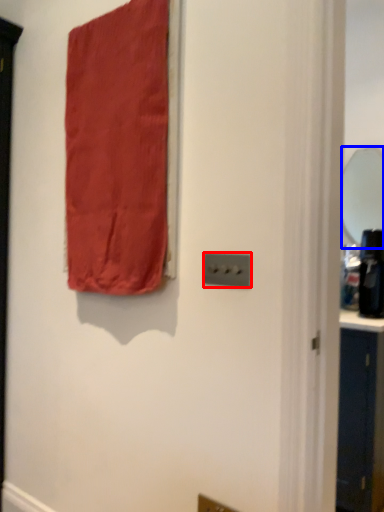
Question: Which of the following is the farthest to the observer, light switch (highlighted by a red box) or mirror (highlighted by a blue box)?

Choices:
 (A) light switch
 (B) mirror

Answer: (B)